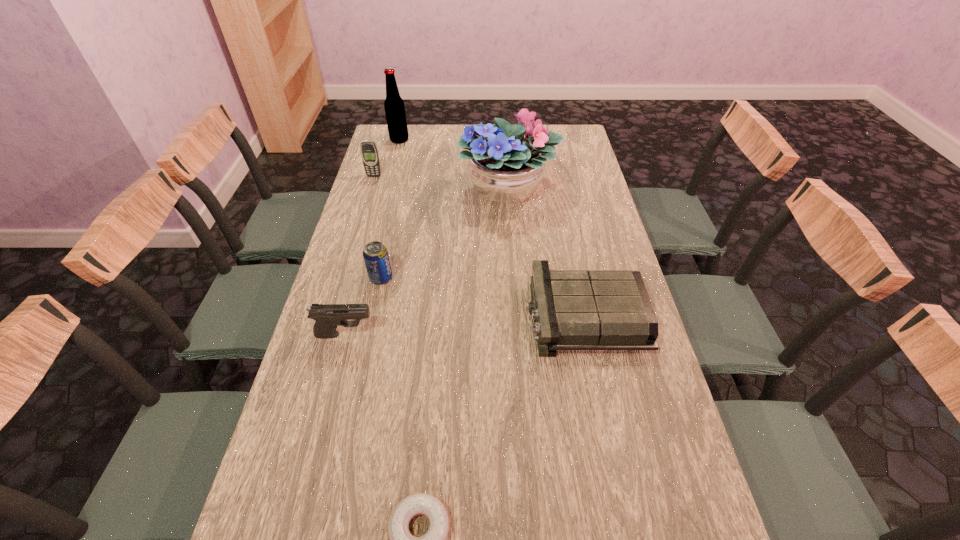
Locate an element on the screen. vacant region between the pistol and the cellular telephone is located at coordinates (359, 255).

Where is `empty location between the sixth tallest object and the cellular telephone`? Image resolution: width=960 pixels, height=540 pixels. empty location between the sixth tallest object and the cellular telephone is located at coordinates (479, 246).

Find the location of `free point between the soda and the bouquet`. free point between the soda and the bouquet is located at coordinates (444, 234).

Identify the location of object that is the second closest one to the cellular telephone. The height and width of the screenshot is (540, 960). (505, 167).

Point out which object is positioned as the third nearest to the cellular telephone. Please provide its 2D coordinates. Your answer should be formatted as a tuple, i.e. [(x, y)], where the tuple contains the x and y coordinates of a point satisfying the conditions above.

[(375, 254)]

Locate an element on the screen. The height and width of the screenshot is (540, 960). vacant point that satisfies the following two spatial constraints: 1. on the screen of the cellular telephone; 2. on the left side of the soda is located at coordinates (344, 278).